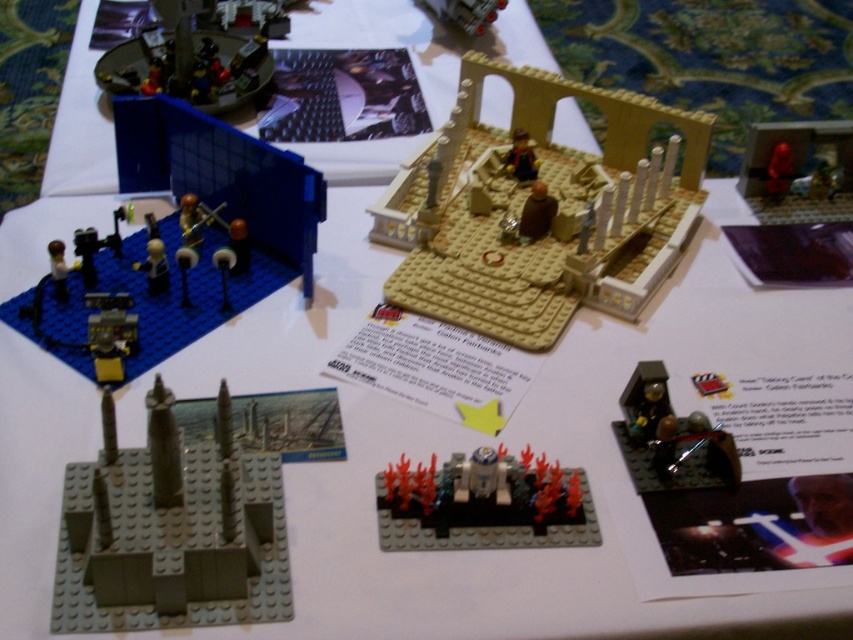
You are standing in front of the LEGO display and want to locate the point at coordinates point (548, 220). Which LEGO model is this point located on?

The point (548, 220) is located on the beige matte building at center.

You are a LEGO enthusiast examining the display. You notice the metallic silver minifigure at lower right and the matte brown minifigure at center. Which minifigure is bigger?

The metallic silver minifigure at lower right is larger than the matte brown minifigure at center.

You are organizing a LEGO display and want to place a small decorative sticker on the object that is smaller between the blue plastic stage at left and the shiny red figure at upper right. Which object should you choose?

The shiny red figure at upper right is smaller than the blue plastic stage at left, so you should place the sticker on the shiny red figure at upper right.